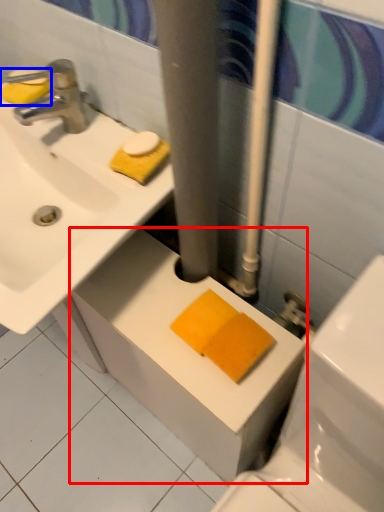
Question: Which point is further to the camera, counter top (highlighted by a red box) or soap (highlighted by a blue box)?

Choices:
 (A) counter top
 (B) soap

Answer: (B)